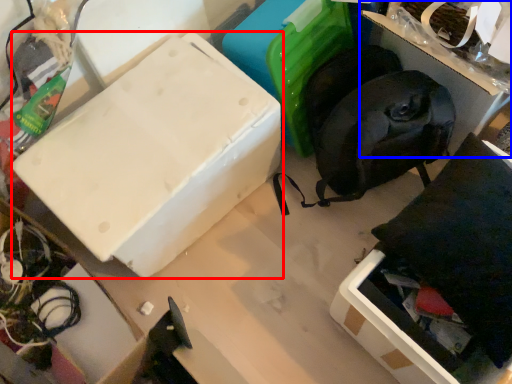
Question: Which point is further to the camera, box (highlighted by a red box) or storage box (highlighted by a blue box)?

Choices:
 (A) box
 (B) storage box

Answer: (A)